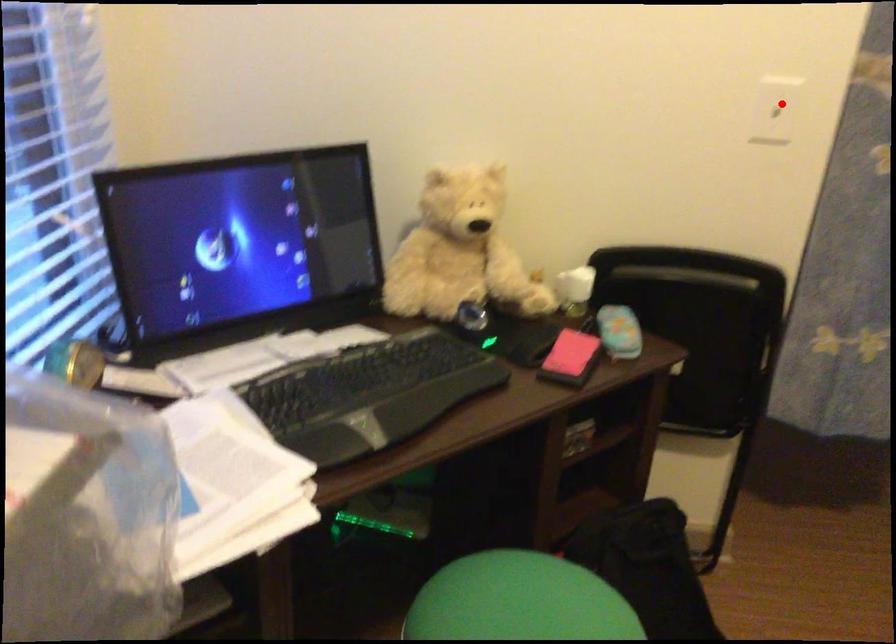
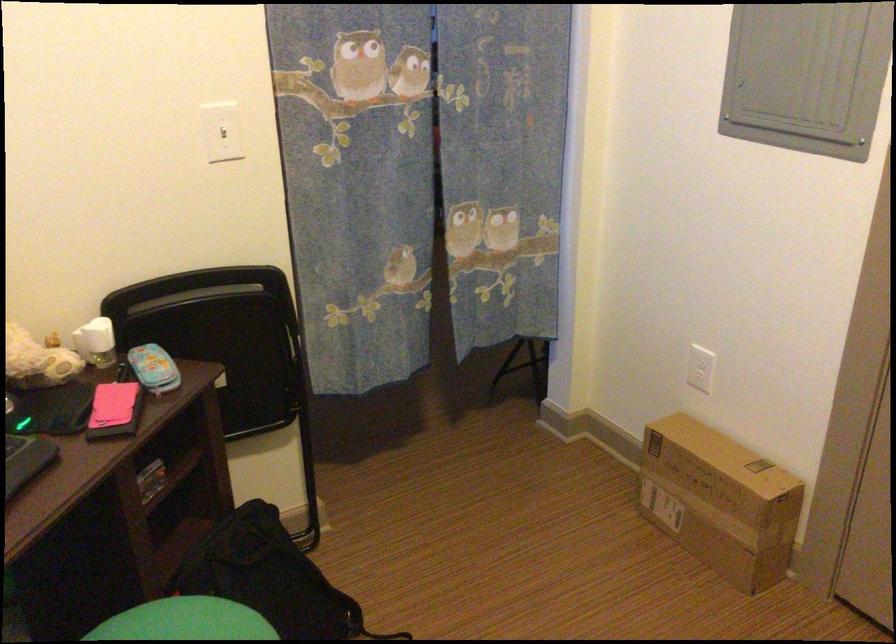
Find the pixel in the second image that matches the highlighted location in the first image.

(222, 131)